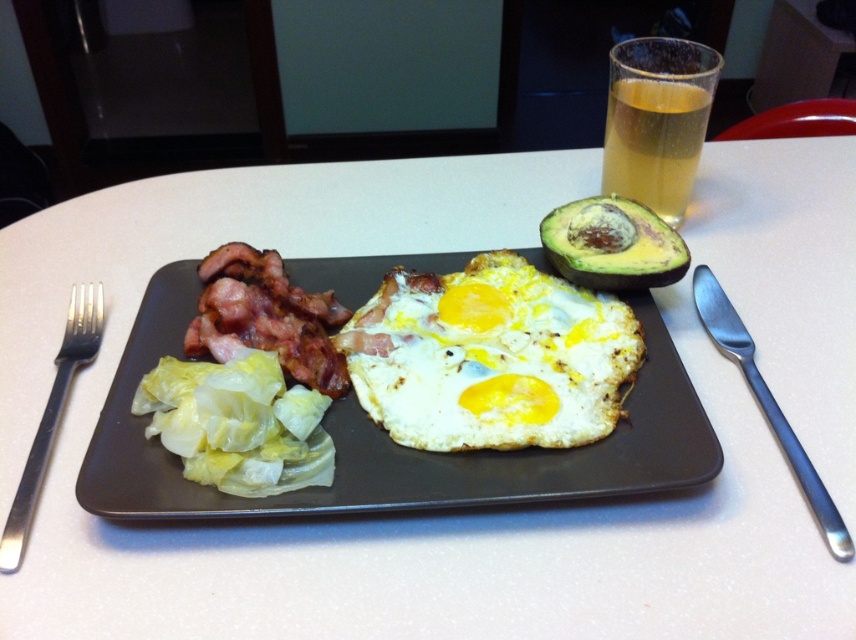
You are looking at the meal on the dark rectangular plate. From your perspective, which of the two points, point (262, 284) or point (611, 211), is closer to you?

Point (262, 284) is in front of point (611, 211), so it is closer to you.

You are setting the table for a meal. You have a matte ceramic plate at center and a satin silver knife at right. According to the arrangement, where should you place the knife relative to the plate?

The satin silver knife at right should be placed to the right of the matte ceramic plate at center, as the matte ceramic plate at center is to the left of the satin silver knife at right.